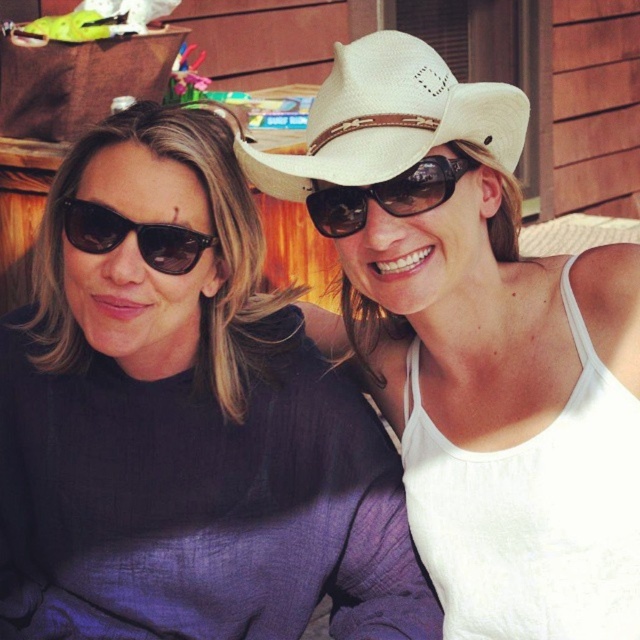
Question: Can you confirm if matte black sweater at left is positioned above matte black sunglasses at left?

Choices:
 (A) no
 (B) yes

Answer: (A)

Question: Estimate the real-world distances between objects in this image. Which object is closer to the white straw hat at upper center?

Choices:
 (A) matte black sunglasses at left
 (B) matte black sweater at left
 (C) matte black sunglasses at center
 (D) white straw cowboy hat at upper center

Answer: (D)

Question: Considering the real-world distances, which object is closest to the matte black sunglasses at center?

Choices:
 (A) matte black sweater at left
 (B) white straw hat at upper center
 (C) white straw cowboy hat at upper center

Answer: (C)

Question: Does matte black sunglasses at center have a smaller size compared to matte black sunglasses at left?

Choices:
 (A) yes
 (B) no

Answer: (B)

Question: Observing the image, what is the correct spatial positioning of white straw hat at upper center in reference to matte black sunglasses at center?

Choices:
 (A) left
 (B) right

Answer: (B)

Question: Which point is farther to the camera?

Choices:
 (A) (388, 99)
 (B) (64, 221)
 (C) (477, 515)
 (D) (182, 392)

Answer: (D)